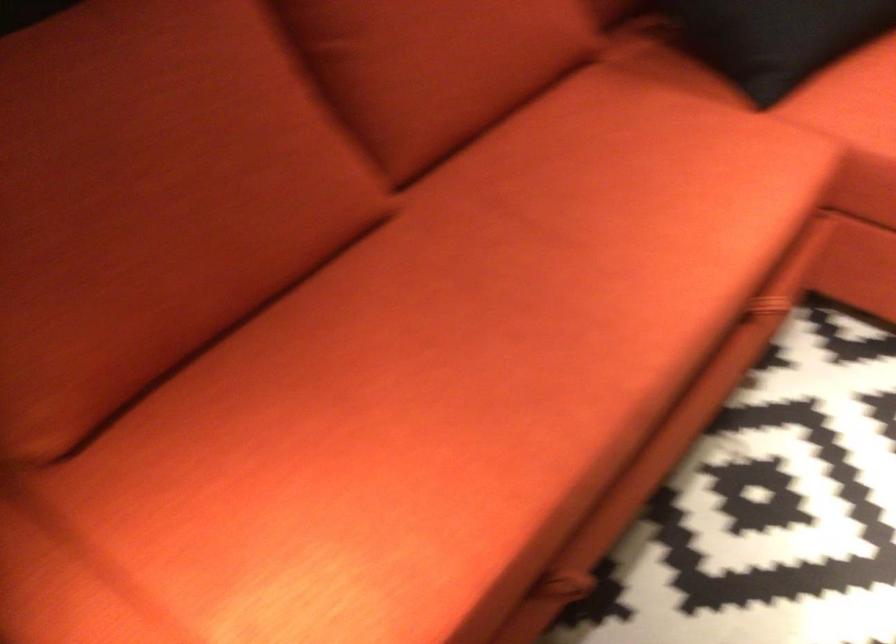
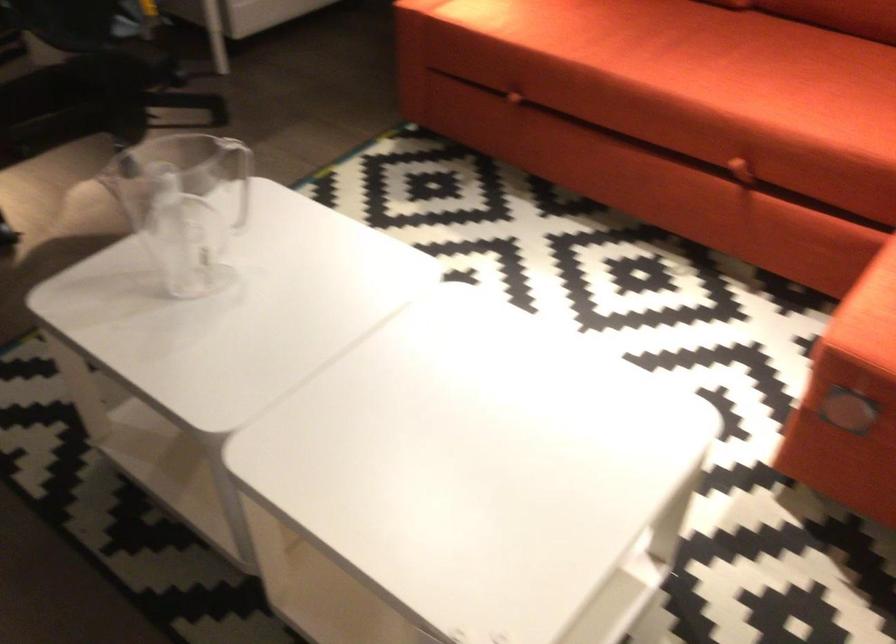
Locate, in the second image, the point that corresponds to the point at 665,301 in the first image.

(688, 80)